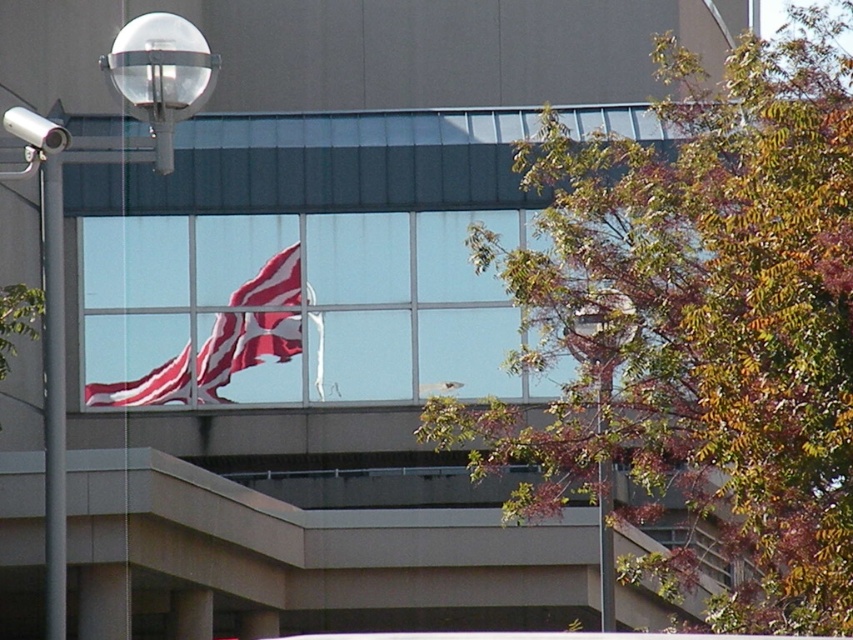
You are standing on the sidewalk in front of the modern building. You notice both the metallic gray pole at left and the metallic glass lamp post at upper center. Which object is taller?

The metallic gray pole at left is much taller than the metallic glass lamp post at upper center.

You are standing at the center of the image and want to walk towards the metallic gray pole at left. Which direction should you face to walk directly towards it?

You should face towards the left direction to walk directly towards the metallic gray pole at left since it is located at the left side of the image.